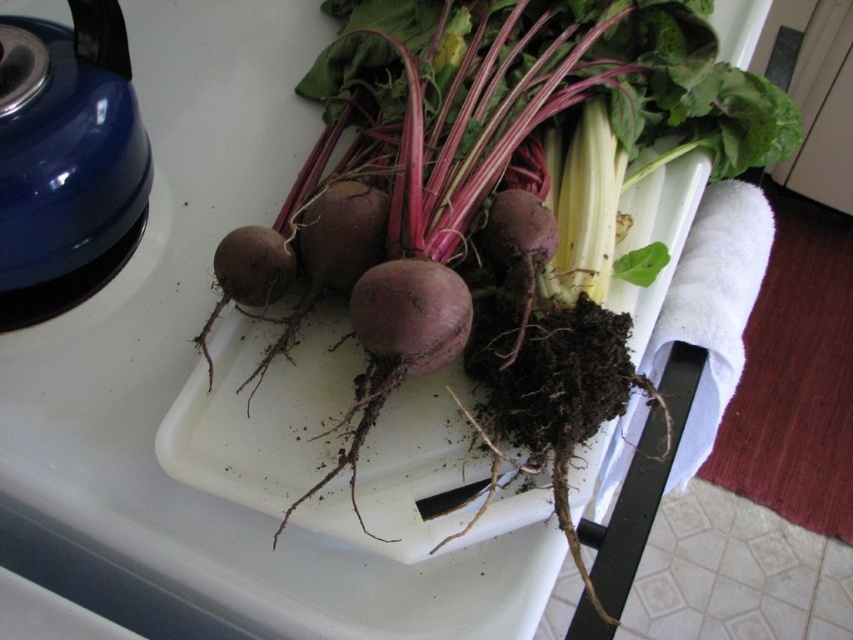
Question: Does purple matte beetroot at center appear on the left side of blue glossy kettle at upper left?

Choices:
 (A) yes
 (B) no

Answer: (B)

Question: Can you confirm if purple matte beetroot at center is positioned to the right of blue glossy kettle at upper left?

Choices:
 (A) no
 (B) yes

Answer: (B)

Question: Which of the following is the closest to the observer?

Choices:
 (A) (569, 298)
 (B) (22, 32)

Answer: (B)

Question: Which object is closer to the camera taking this photo?

Choices:
 (A) purple matte beetroot at center
 (B) blue glossy kettle at upper left

Answer: (A)

Question: Where is purple matte beetroot at center located in relation to blue glossy kettle at upper left in the image?

Choices:
 (A) above
 (B) below

Answer: (A)